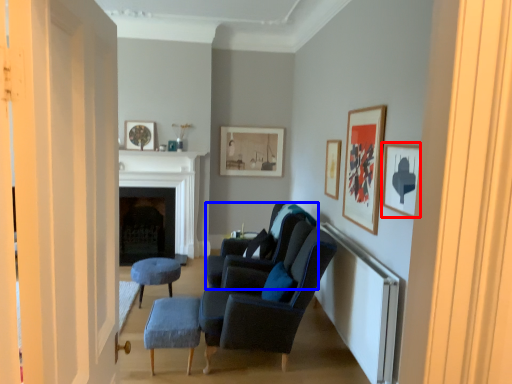
Question: Which point is further to the camera, picture frame (highlighted by a red box) or chair (highlighted by a blue box)?

Choices:
 (A) picture frame
 (B) chair

Answer: (B)